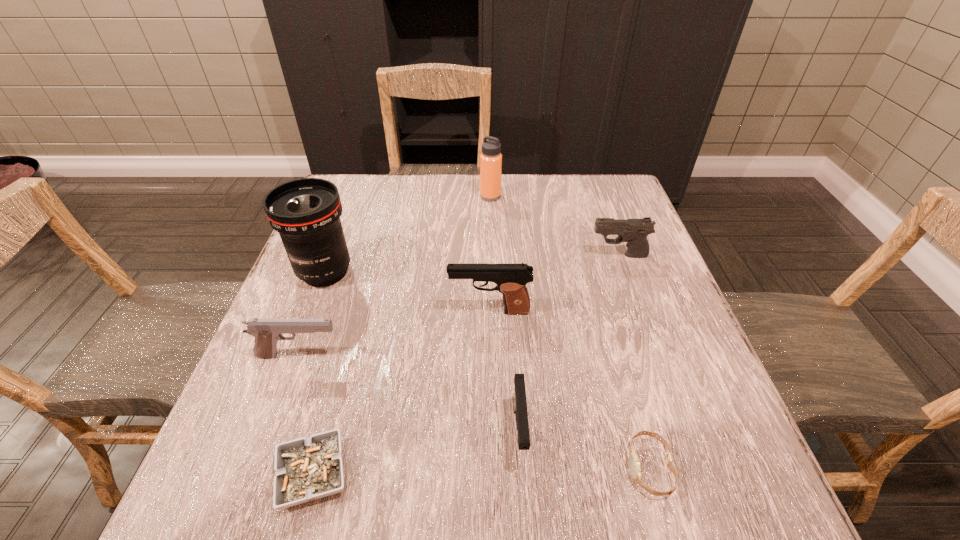
This screenshot has width=960, height=540. I want to click on vacant space that's between the second shortest object and the second nearest pistol, so click(x=474, y=411).

Find the location of a particular element. The image size is (960, 540). vacant point located between the thermos bottle and the farthest pistol is located at coordinates (555, 226).

The image size is (960, 540). I want to click on object that stands as the second closest to the farthest object, so coord(306,212).

Select which object is the closest to the second shortest object. Please provide its 2D coordinates. Your answer should be formatted as a tuple, i.e. [(x, y)], where the tuple contains the x and y coordinates of a point satisfying the conditions above.

[(519, 396)]

Locate which pistol ranks second in proximity to the shortest pistol. Please provide its 2D coordinates. Your answer should be formatted as a tuple, i.e. [(x, y)], where the tuple contains the x and y coordinates of a point satisfying the conditions above.

[(267, 332)]

Select which pistol is the second closest to the seventh tallest object. Please provide its 2D coordinates. Your answer should be formatted as a tuple, i.e. [(x, y)], where the tuple contains the x and y coordinates of a point satisfying the conditions above.

[(511, 279)]

Locate an element on the screen. vacant space that satisfies the following two spatial constraints: 1. at the barrel of the ashtray; 2. on the left side of the second nearest pistol is located at coordinates (255, 474).

I want to click on vacant space that satisfies the following two spatial constraints: 1. on the front side of the farthest object; 2. at the barrel of the second farthest pistol, so click(x=494, y=311).

Locate an element on the screen. The height and width of the screenshot is (540, 960). vacant space that satisfies the following two spatial constraints: 1. at the barrel of the third tallest object; 2. on the front side of the shortest object is located at coordinates (493, 474).